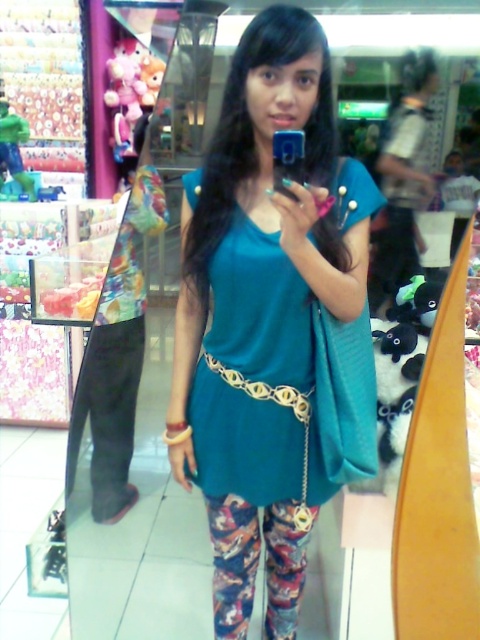
You are trying to decide between two teal fabric items at the center of the store. The teal fabric dress at center and the teal fabric shirt at center. Which one is shorter in length?

The teal fabric dress at center is shorter than the teal fabric shirt at center.

You are a customer in the store and want to see both the teal fabric dress at center and the teal fabric shirt at center. Since they are placed close together, which one do you need to move first to get a better view of the one behind?

The teal fabric dress at center is in front of the teal fabric shirt at center, so you need to move the teal fabric dress at center first to see the teal fabric shirt at center behind it.